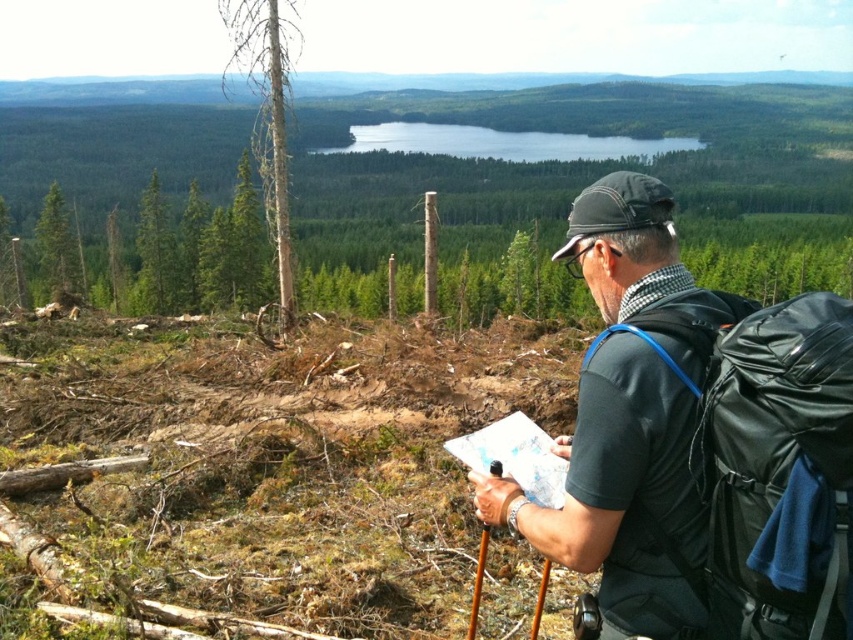
Who is positioned more to the right, green matte tree at upper left or green rough bark tree at left?

green matte tree at upper left is more to the right.

Does green matte tree at upper left have a larger size compared to green rough bark tree at left?

No, green matte tree at upper left is not bigger than green rough bark tree at left.

Between point (154, 196) and point (44, 209), which one is positioned in front?

Point (154, 196)

The width and height of the screenshot is (853, 640). What are the coordinates of `green matte tree at upper left` in the screenshot? It's located at (155, 252).

Is point (624, 515) farther from viewer compared to point (271, 131)?

No, it is in front of (271, 131).

Consider the image. Which is above, black fabric backpack at right or white smooth tree at upper left?

white smooth tree at upper left is higher up.

Who is more distant from viewer, (692, 412) or (260, 17)?

Point (260, 17)

Identify the location of black fabric backpack at right. This screenshot has width=853, height=640. (630, 422).

Which of these two, smooth bark tree at center or white smooth tree at upper left, stands shorter?

smooth bark tree at center

In the scene shown: Does smooth bark tree at center appear on the left side of white smooth tree at upper left?

No, smooth bark tree at center is not to the left of white smooth tree at upper left.

Is point (558, 189) positioned before point (274, 108)?

No, it is behind (274, 108).

You are a GUI agent. You are given a task and a screenshot of the screen. Output one action in this format:
    pyautogui.click(x=<x>, y=<y>)
    Task: Click on the smooth bark tree at center
    
    Given the screenshot: What is the action you would take?
    pyautogui.click(x=508, y=259)